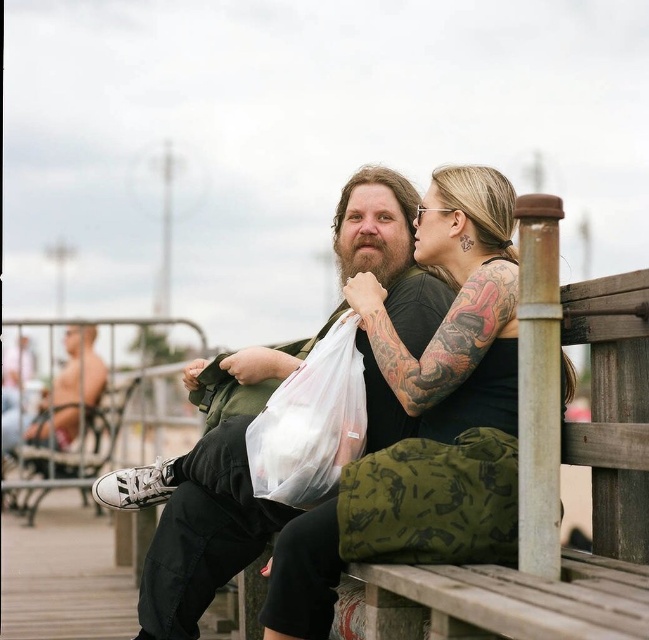
Between black matte tank top at center and white plastic bag at lower left, which one appears on the left side from the viewer's perspective?

Positioned to the left is white plastic bag at lower left.

Between point (454, 435) and point (43, 456), which one is positioned in front?

Positioned in front is point (454, 435).

Identify the location of black matte tank top at center. The width and height of the screenshot is (649, 640). (456, 308).

Where is `black matte tank top at center`? The width and height of the screenshot is (649, 640). black matte tank top at center is located at coordinates 456,308.

Who is positioned more to the left, green canvas jacket at center or transparent plastic bag at center?

green canvas jacket at center is more to the left.

Between point (206, 545) and point (312, 404), which one is positioned behind?

Point (206, 545)

The image size is (649, 640). What do you see at coordinates (204, 492) in the screenshot? I see `green canvas jacket at center` at bounding box center [204, 492].

Where is `green canvas jacket at center`? green canvas jacket at center is located at coordinates (204, 492).

Is camouflage fabric bag at lower right shorter than transparent plastic bag at center?

Incorrect, camouflage fabric bag at lower right's height does not fall short of transparent plastic bag at center's.

Which of these two, camouflage fabric bag at lower right or transparent plastic bag at center, stands shorter?

With less height is transparent plastic bag at center.

Image resolution: width=649 pixels, height=640 pixels. I want to click on camouflage fabric bag at lower right, so click(432, 500).